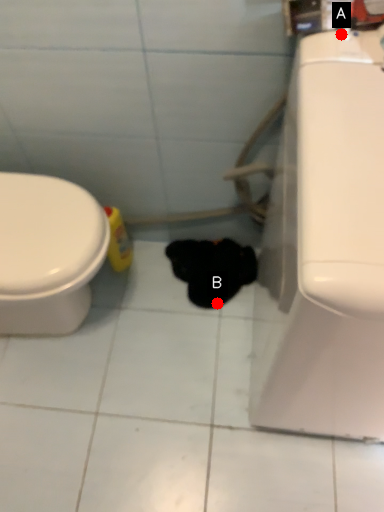
Question: Two points are circled on the image, labeled by A and B beside each circle. Among these points, which one is nearest to the camera?

Choices:
 (A) A is closer
 (B) B is closer

Answer: (A)